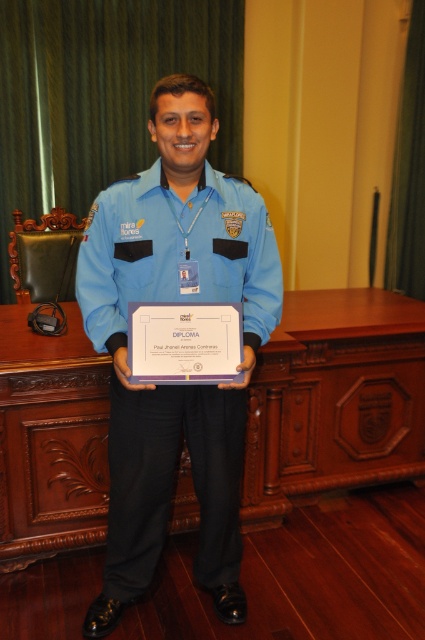
Consider the image. You are a photographer positioned in front of the wooden at center and the blue fabric uniform at center. Which object is closer to you?

The wooden at center is closer to you than the blue fabric uniform at center.

You are a photographer positioned in front of the scene. You notice two points marked in the image at coordinates point (246, 436) and point (198, 257). Which point is closer to your camera?

Point (246, 436) is further to the viewer than point (198, 257), so the point closer to the camera is point (198, 257).

You are attending a formal ceremony and notice a wooden object at center in the image. Where exactly is the wooden at center positioned in terms of coordinates?

The wooden at center is positioned at coordinates point (334, 400).